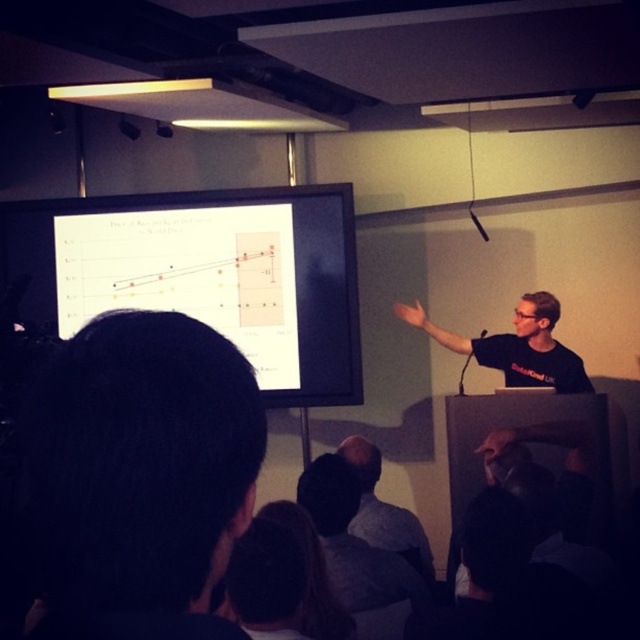
You are an attendee at the presentation and want to take a photo of the speaker. The speaker is standing in front of the projection screen. To ensure the speaker is fully visible in the photo, which object should you focus on first, the dark hair at lower left or the black matte shirt at center?

You should focus on the black matte shirt at center first because the dark hair at lower left is shorter than the black matte shirt at center, ensuring the taller object is in frame first.

You are a photographer trying to capture a closeup of the dark hair at lower left during the presentation. Given that your camera has a minimum focus distance of 18 inches, will you be able to take the photo without moving closer?

The dark hair at lower left is 18.34 inches from the camera. Since the minimum focus distance is 18 inches, the camera can focus at that distance, so yes, you can take the photo without moving closer.